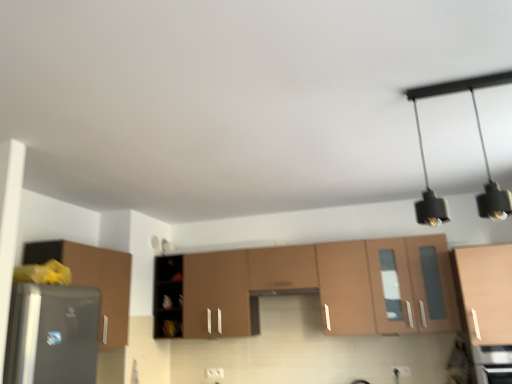
Question: Is matte wood cabinet at right, which ranks as the third cabinetry in left-to-right order, situated inside matte brown cabinet at center, arranged as the 2th cabinetry when viewed from the right, or outside?

Choices:
 (A) outside
 (B) inside

Answer: (A)

Question: From their relative heights in the image, would you say matte wood cabinet at right, which ranks as the third cabinetry in left-to-right order, is taller or shorter than matte brown cabinet at center, the 2th cabinetry viewed from the left?

Choices:
 (A) short
 (B) tall

Answer: (A)

Question: Estimate the real-world distances between objects in this image. Which object is farther from the black matte light fixture at upper right?

Choices:
 (A) matte brown cabinet at left, acting as the first cabinetry starting from the left
 (B) satin black oven at lower right
 (C) matte brown cabinet at center, arranged as the 2th cabinetry when viewed from the right
 (D) matte wood cabinet at right, which ranks as the first cabinetry in right-to-left order

Answer: (A)

Question: Based on their relative distances, which object is farther from the black matte light fixture at upper right?

Choices:
 (A) matte brown cabinet at left, arranged as the 3th cabinetry when viewed from the right
 (B) matte wood cabinet at right, which ranks as the third cabinetry in left-to-right order
 (C) matte brown cabinet at center, arranged as the 2th cabinetry when viewed from the right
 (D) satin black oven at lower right

Answer: (A)